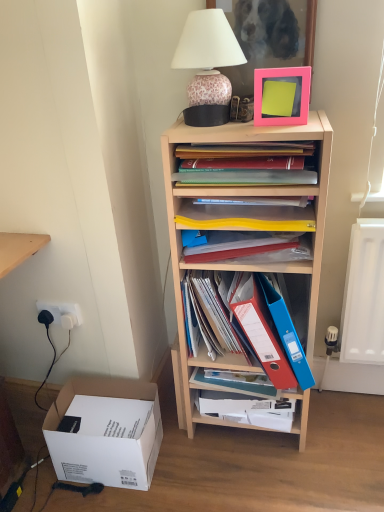
Question: In which direction should I rotate to look at matte blue folder at center, which is the third book from top to bottom?

Choices:
 (A) left
 (B) right

Answer: (B)

Question: Is black plastic electric outlet at lower left at the back of pink matte picture frame at upper center, marked as the second picture frame in a top-to-bottom arrangement?

Choices:
 (A) yes
 (B) no

Answer: (B)

Question: Considering the relative positions of pink matte picture frame at upper center, acting as the 1th picture frame starting from the bottom, and black plastic electric outlet at lower left in the image provided, is pink matte picture frame at upper center, acting as the 1th picture frame starting from the bottom, to the right of black plastic electric outlet at lower left from the viewer's perspective?

Choices:
 (A) no
 (B) yes

Answer: (B)

Question: From a real-world perspective, is pink matte picture frame at upper center, acting as the 1th picture frame starting from the bottom, located beneath black plastic electric outlet at lower left?

Choices:
 (A) yes
 (B) no

Answer: (B)

Question: Does pink matte picture frame at upper center, marked as the second picture frame in a top-to-bottom arrangement, appear on the left side of black plastic electric outlet at lower left?

Choices:
 (A) no
 (B) yes

Answer: (A)

Question: From the image's perspective, is pink matte picture frame at upper center, acting as the 1th picture frame starting from the bottom, above black plastic electric outlet at lower left?

Choices:
 (A) yes
 (B) no

Answer: (A)

Question: Is pink matte picture frame at upper center, acting as the 1th picture frame starting from the bottom, smaller than black plastic electric outlet at lower left?

Choices:
 (A) yes
 (B) no

Answer: (B)

Question: Is leopard print ceramic lamp at upper center to the right of white plastic power outlet at lower left from the viewer's perspective?

Choices:
 (A) yes
 (B) no

Answer: (A)

Question: Considering the relative sizes of leopard print ceramic lamp at upper center and white plastic power outlet at lower left in the image provided, is leopard print ceramic lamp at upper center wider than white plastic power outlet at lower left?

Choices:
 (A) yes
 (B) no

Answer: (A)

Question: Can you confirm if leopard print ceramic lamp at upper center is taller than white plastic power outlet at lower left?

Choices:
 (A) yes
 (B) no

Answer: (A)

Question: From a real-world perspective, is leopard print ceramic lamp at upper center on white plastic power outlet at lower left?

Choices:
 (A) no
 (B) yes

Answer: (B)

Question: Is leopard print ceramic lamp at upper center turned away from white plastic power outlet at lower left?

Choices:
 (A) no
 (B) yes

Answer: (A)

Question: From the image's perspective, would you say leopard print ceramic lamp at upper center is positioned over white plastic power outlet at lower left?

Choices:
 (A) yes
 (B) no

Answer: (A)

Question: Considering the relative positions of matte blue folder at center, marked as the 1th book in a bottom-to-top arrangement, and leopard print ceramic lamp at upper center in the image provided, is matte blue folder at center, marked as the 1th book in a bottom-to-top arrangement, to the left of leopard print ceramic lamp at upper center from the viewer's perspective?

Choices:
 (A) no
 (B) yes

Answer: (A)